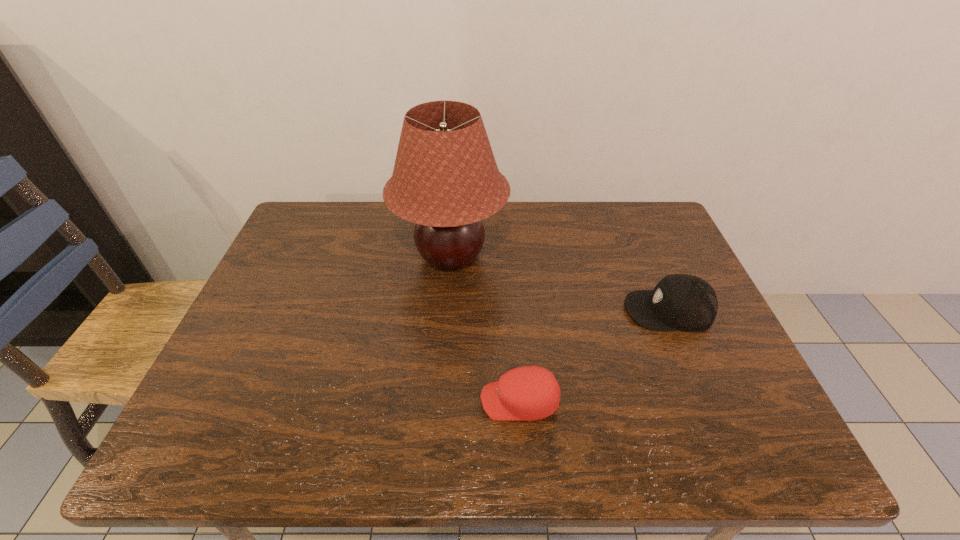
Find the location of a particular element. free spot located 0.240m on the front-facing side of the left cap is located at coordinates (366, 401).

This screenshot has height=540, width=960. In order to click on vacant region located on the front-facing side of the left cap in this screenshot , I will do `click(366, 401)`.

Where is `object located at the far edge`? object located at the far edge is located at coordinates (445, 179).

This screenshot has height=540, width=960. In order to click on object situated at the near edge in this screenshot , I will do `click(528, 393)`.

At what (x,y) coordinates should I click in order to perform the action: click on object present at the right edge. Please return your answer as a coordinate pair (x, y). Image resolution: width=960 pixels, height=540 pixels. Looking at the image, I should click on (684, 302).

In the image, there is a desktop. Identify the location of vacant space at the far edge. This screenshot has height=540, width=960. (583, 218).

Locate an element on the screen. free spot at the near edge of the desktop is located at coordinates (468, 428).

Image resolution: width=960 pixels, height=540 pixels. In order to click on vacant space at the left edge of the desktop in this screenshot , I will do `click(309, 251)`.

Where is `free location at the right edge of the desktop`? This screenshot has width=960, height=540. free location at the right edge of the desktop is located at coordinates (706, 334).

At what (x,y) coordinates should I click in order to perform the action: click on blank space at the far left corner. Please return your answer as a coordinate pair (x, y). Image resolution: width=960 pixels, height=540 pixels. Looking at the image, I should click on (325, 236).